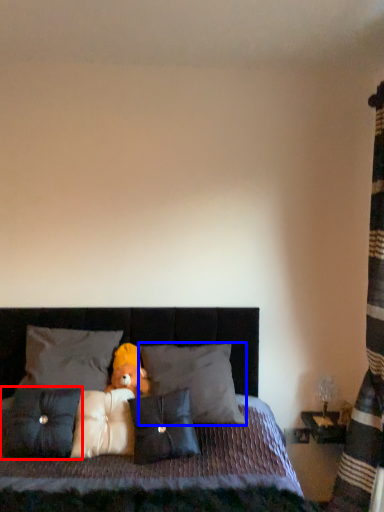
Question: Among these objects, which one is nearest to the camera, pillow (highlighted by a red box) or pillow (highlighted by a blue box)?

Choices:
 (A) pillow
 (B) pillow

Answer: (A)